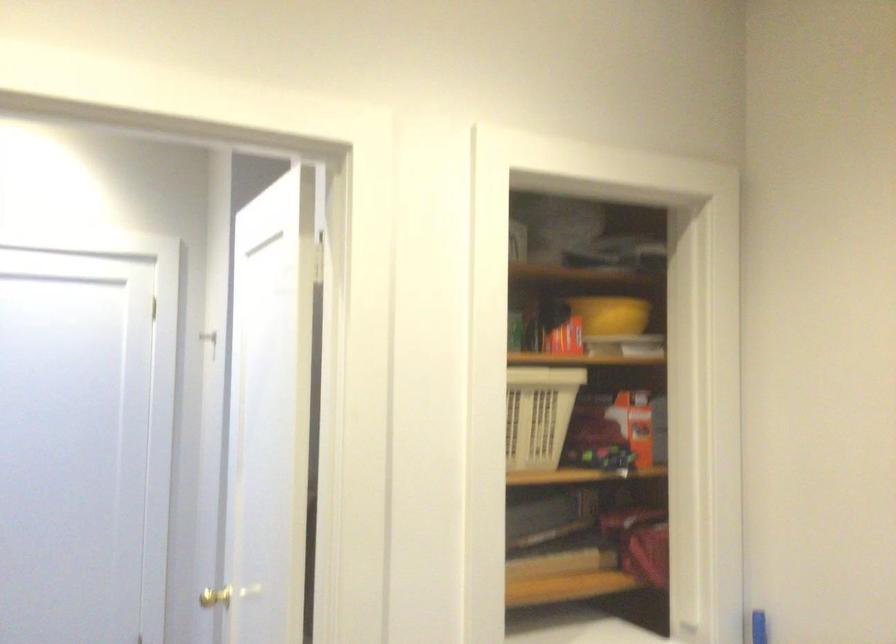
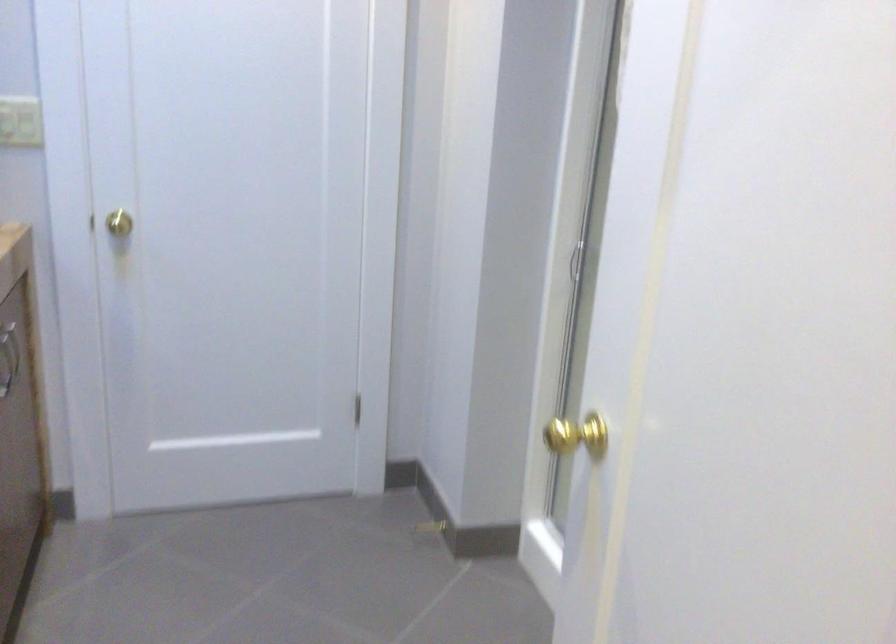
What movement of the cameraman would produce the second image?

The cameraman moved toward left, forward.